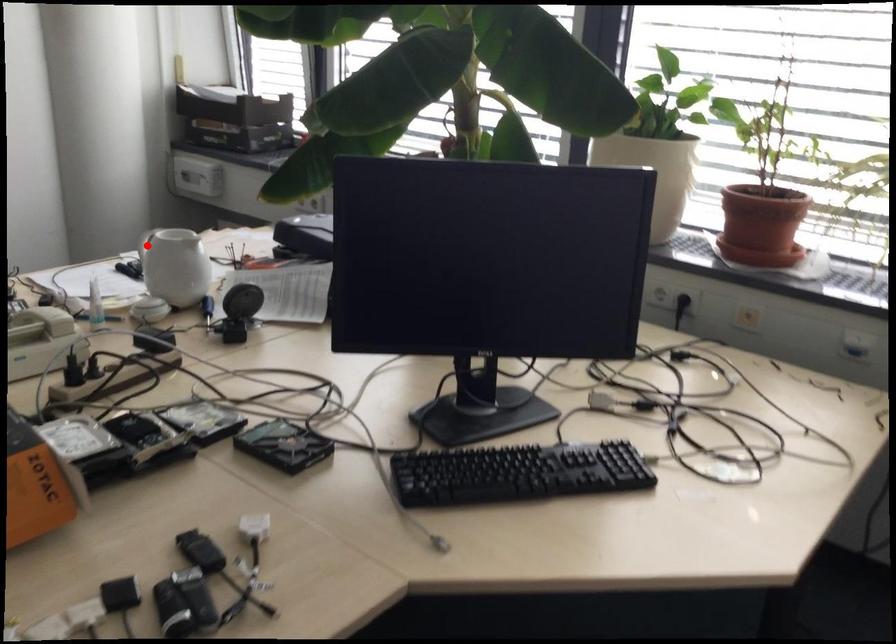
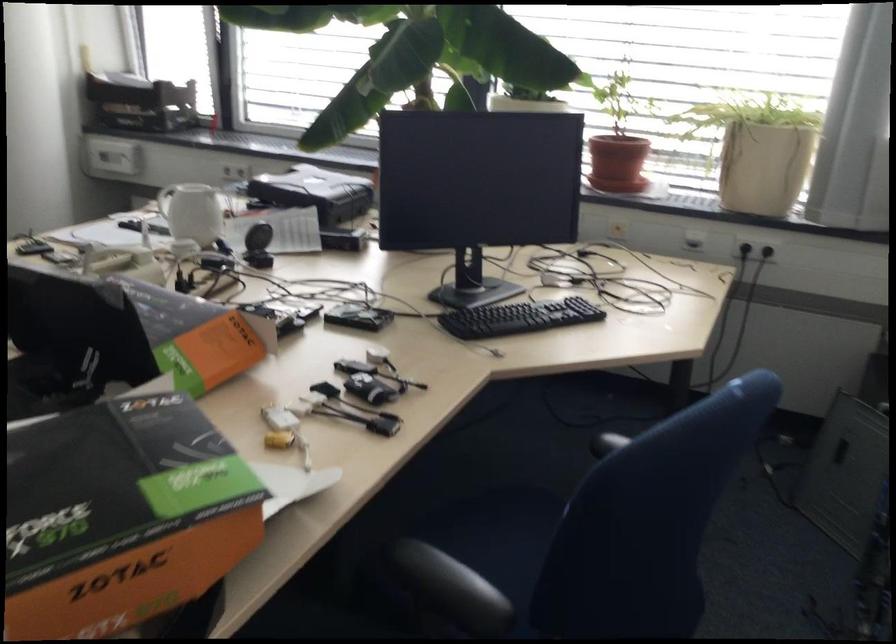
Question: A red point is marked in image1. In image2, is the corresponding 3D point closer to the camera or farther? Reply with the corresponding letter.

Choices:
 (A) The corresponding 3D point is closer.
 (B) The corresponding 3D point is farther.

Answer: (B)